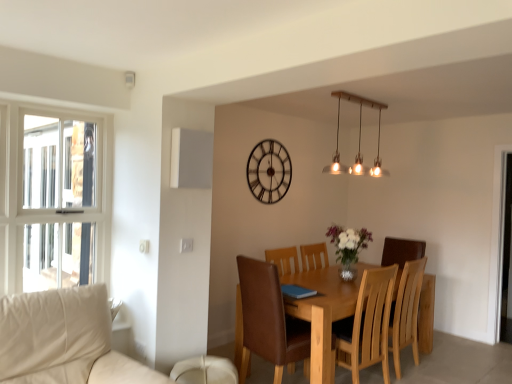
Locate an element on the screen. Image resolution: width=512 pixels, height=384 pixels. matte brass pendant lights at upper center is located at coordinates (359, 140).

Where is `light brown wooden table at center`? light brown wooden table at center is located at coordinates (323, 312).

Image resolution: width=512 pixels, height=384 pixels. What do you see at coordinates (323, 312) in the screenshot?
I see `light brown wooden table at center` at bounding box center [323, 312].

This screenshot has width=512, height=384. Identify the location of matte brass pendant lights at upper center. (359, 140).

From a real-world perspective, which is physically above, metallic clock at upper center or brown leather chair at center, acting as the first chair starting from the front?

metallic clock at upper center.

In terms of width, does metallic clock at upper center look wider or thinner when compared to brown leather chair at center, the first chair in the left-to-right sequence?

In the image, metallic clock at upper center appears to be more narrow than brown leather chair at center, the first chair in the left-to-right sequence.

Is metallic clock at upper center outside of brown leather chair at center, the first chair in the left-to-right sequence?

Yes.

Is metallic clock at upper center at the left side of brown leather chair at center, the first chair in the left-to-right sequence?

Yes.

Considering the sizes of objects metallic clock at upper center and translucent glass vase at center in the image provided, who is shorter, metallic clock at upper center or translucent glass vase at center?

translucent glass vase at center.

Is metallic clock at upper center placed right next to translucent glass vase at center?

metallic clock at upper center and translucent glass vase at center are clearly separated.

Which is further, [249,174] or [351,252]?

The point [249,174] is farther from the camera.

Based on the photo, would you say matte brass pendant lights at upper center is outside translucent glass vase at center?

Yes, matte brass pendant lights at upper center is not within translucent glass vase at center.

Does matte brass pendant lights at upper center have a lesser width compared to translucent glass vase at center?

Indeed, matte brass pendant lights at upper center has a lesser width compared to translucent glass vase at center.

From the image's perspective, is matte brass pendant lights at upper center below translucent glass vase at center?

No, from the image's perspective, matte brass pendant lights at upper center is not beneath translucent glass vase at center.

Does matte brass pendant lights at upper center have a greater height compared to translucent glass vase at center?

Yes.

From a real-world perspective, is translucent glass vase at center physically below light brown wood chair at center, the first chair from the back?

No, from a real-world perspective, translucent glass vase at center is not beneath light brown wood chair at center, the first chair from the back.

Which is closer, (353,255) or (368,363)?

The point (368,363) is more forward.

Is there a large distance between translucent glass vase at center and light brown wood chair at center, the second chair when ordered from front to back?

No, translucent glass vase at center is not far from light brown wood chair at center, the second chair when ordered from front to back.

Does translucent glass vase at center have a larger size compared to light brown wood chair at center, the second chair when ordered from front to back?

Actually, translucent glass vase at center might be smaller than light brown wood chair at center, the second chair when ordered from front to back.

Considering the sizes of objects metallic clock at upper center and matte brass pendant lights at upper center in the image provided, who is taller, metallic clock at upper center or matte brass pendant lights at upper center?

Standing taller between the two is metallic clock at upper center.

Does metallic clock at upper center touch matte brass pendant lights at upper center?

No, metallic clock at upper center is not beside matte brass pendant lights at upper center.

Between metallic clock at upper center and matte brass pendant lights at upper center, which one has smaller width?

With smaller width is metallic clock at upper center.

Who is smaller, metallic clock at upper center or matte brass pendant lights at upper center?

With smaller size is metallic clock at upper center.

Does point (402, 296) come in front of point (348, 170)?

Yes, it is.

From the image's perspective, is light brown wood chair at center, the 1th chair when ordered from right to left, under matte brass pendant lights at upper center?

Indeed, from the image's perspective, light brown wood chair at center, the 1th chair when ordered from right to left, is shown beneath matte brass pendant lights at upper center.

Considering the relative positions of light brown wood chair at center, the first chair from the back, and matte brass pendant lights at upper center in the image provided, is light brown wood chair at center, the first chair from the back, to the left of matte brass pendant lights at upper center from the viewer's perspective?

Incorrect, light brown wood chair at center, the first chair from the back, is not on the left side of matte brass pendant lights at upper center.

How far apart are light brown wood chair at center, which is the 2th chair from left to right, and matte brass pendant lights at upper center?

light brown wood chair at center, which is the 2th chair from left to right, and matte brass pendant lights at upper center are 1.73 meters apart.

Which is more to the left, brown leather chair at center, the first chair in the left-to-right sequence, or translucent glass vase at center?

From the viewer's perspective, brown leather chair at center, the first chair in the left-to-right sequence, appears more on the left side.

Which is farther, (259, 320) or (336, 228)?

The point (336, 228) is behind.

Is brown leather chair at center, the second chair when ordered from back to front, taller or shorter than translucent glass vase at center?

brown leather chair at center, the second chair when ordered from back to front, is taller than translucent glass vase at center.

Where is `clock on the left side of brown leather chair at center, acting as the first chair starting from the front`? This screenshot has width=512, height=384. clock on the left side of brown leather chair at center, acting as the first chair starting from the front is located at coordinates (269, 171).

Where is `flower below the metallic clock at upper center (from the image's perspective)`? flower below the metallic clock at upper center (from the image's perspective) is located at coordinates (348, 242).

When comparing their distances from translucent glass vase at center, does light brown wooden table at center or brown leather chair at center, acting as the first chair starting from the front, seem closer?

light brown wooden table at center is positioned closer to the anchor translucent glass vase at center.

When comparing their distances from brown leather chair at center, which is counted as the second chair, starting from the right, does light brown wooden table at center or light brown wood chair at center, the first chair from the back, seem further?

light brown wood chair at center, the first chair from the back, is further to brown leather chair at center, which is counted as the second chair, starting from the right.

Based on their spatial positions, is matte brass pendant lights at upper center or light brown wooden table at center further from light brown wood chair at center, the first chair from the back?

matte brass pendant lights at upper center.

In the scene shown: From the image, which object appears to be nearer to light brown wood chair at center, the first chair from the back, light brown wooden table at center or translucent glass vase at center?

light brown wooden table at center is positioned closer to the anchor light brown wood chair at center, the first chair from the back.

When comparing their distances from translucent glass vase at center, does light brown wood chair at center, the 1th chair when ordered from right to left, or brown leather chair at center, acting as the first chair starting from the front, seem further?

Based on the image, brown leather chair at center, acting as the first chair starting from the front, appears to be further to translucent glass vase at center.

Which object lies nearer to the anchor point light brown wooden table at center, matte brass pendant lights at upper center or metallic clock at upper center?

Among the two, metallic clock at upper center is located nearer to light brown wooden table at center.

Which object lies nearer to the anchor point light brown wooden table at center, light brown wood chair at center, the second chair when ordered from front to back, or matte brass pendant lights at upper center?

light brown wood chair at center, the second chair when ordered from front to back, lies closer to light brown wooden table at center than the other object.

Based on their spatial positions, is light brown wood chair at center, the second chair when ordered from front to back, or matte brass pendant lights at upper center closer to brown leather chair at center, which is counted as the second chair, starting from the right?

light brown wood chair at center, the second chair when ordered from front to back, is positioned closer to the anchor brown leather chair at center, which is counted as the second chair, starting from the right.

The image size is (512, 384). Identify the location of kitchen & dining room table located between brown leather chair at center, the first chair in the left-to-right sequence, and metallic clock at upper center in the depth direction. (323, 312).

The width and height of the screenshot is (512, 384). Find the location of `flower between light brown wooden table at center and metallic clock at upper center along the z-axis`. flower between light brown wooden table at center and metallic clock at upper center along the z-axis is located at coordinates (348, 242).

This screenshot has width=512, height=384. Identify the location of kitchen & dining room table situated between brown leather chair at center, the second chair when ordered from back to front, and light brown wood chair at center, the 1th chair when ordered from right to left, from left to right. (323, 312).

Identify the location of chair between brown leather chair at center, the first chair in the left-to-right sequence, and metallic clock at upper center from front to back. (380, 320).